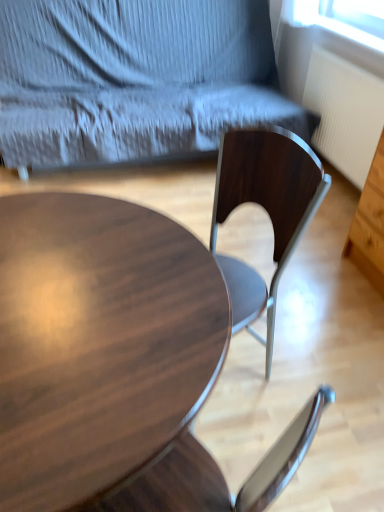
Question: Considering the positions of point (3, 265) and point (316, 123), is point (3, 265) closer or farther from the camera than point (316, 123)?

Choices:
 (A) farther
 (B) closer

Answer: (B)

Question: Do you think shiny dark wood coffee table at center is within wooden chair at center, or outside of it?

Choices:
 (A) inside
 (B) outside

Answer: (B)

Question: Which of these objects is positioned closest to the wooden chair at center?

Choices:
 (A) white ribbed radiator at right
 (B) shiny dark wood coffee table at center

Answer: (A)

Question: Estimate the real-world distances between objects in this image. Which object is farther from the white ribbed radiator at right?

Choices:
 (A) wooden chair at center
 (B) shiny dark wood coffee table at center

Answer: (B)